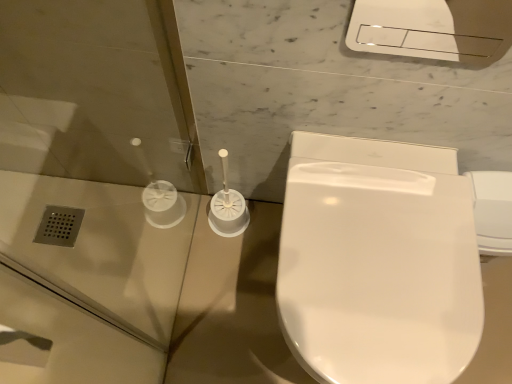
Question: From the image's perspective, is white glossy toilet at center located above or below transparent plastic screen door at left?

Choices:
 (A) below
 (B) above

Answer: (A)

Question: Considering the positions of white glossy toilet at center and transparent plastic screen door at left in the image, is white glossy toilet at center wider or thinner than transparent plastic screen door at left?

Choices:
 (A) wide
 (B) thin

Answer: (A)

Question: From a real-world perspective, relative to transparent plastic screen door at left, is white glossy toilet at center vertically above or below?

Choices:
 (A) below
 (B) above

Answer: (A)

Question: Do you think transparent plastic screen door at left is within white glossy toilet at center, or outside of it?

Choices:
 (A) inside
 (B) outside

Answer: (B)

Question: In the image, is transparent plastic screen door at left positioned in front of or behind white glossy toilet at center?

Choices:
 (A) front
 (B) behind

Answer: (A)

Question: In terms of width, does transparent plastic screen door at left look wider or thinner when compared to white glossy toilet at center?

Choices:
 (A) thin
 (B) wide

Answer: (A)

Question: From their relative heights in the image, would you say transparent plastic screen door at left is taller or shorter than white glossy toilet at center?

Choices:
 (A) tall
 (B) short

Answer: (A)